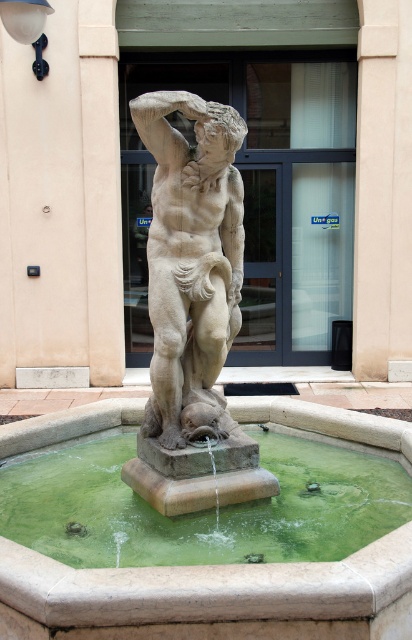
Looking at this image, is stone statue at center wider than beige stone pillar at upper center?

In fact, stone statue at center might be narrower than beige stone pillar at upper center.

Which is behind, point (157, 228) or point (374, 284)?

The point (374, 284) is behind.

I want to click on stone statue at center, so click(x=191, y=253).

Is point (337, 452) positioned after point (355, 280)?

No, it is not.

Is green stone water at center to the left of beige stone pillar at upper center from the viewer's perspective?

Indeed, green stone water at center is positioned on the left side of beige stone pillar at upper center.

Does point (255, 541) come behind point (367, 77)?

That is False.

Where is `green stone water at center`? The height and width of the screenshot is (640, 412). green stone water at center is located at coordinates (203, 509).

Does green stone water at center lie behind stone statue at center?

No, it is not.

Who is positioned more to the right, green stone water at center or stone statue at center?

Positioned to the right is stone statue at center.

Is point (48, 556) positioned before point (171, 144)?

Yes, point (48, 556) is in front of point (171, 144).

In order to click on green stone water at center in this screenshot , I will do `click(203, 509)`.